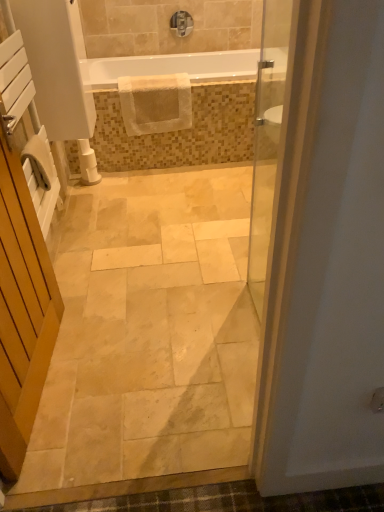
Question: From the image's perspective, is white glossy bathtub at upper center located beneath matte silver faucet at upper center?

Choices:
 (A) no
 (B) yes

Answer: (B)

Question: Is white glossy bathtub at upper center behind matte silver faucet at upper center?

Choices:
 (A) no
 (B) yes

Answer: (A)

Question: Considering the relative sizes of white glossy bathtub at upper center and matte silver faucet at upper center in the image provided, is white glossy bathtub at upper center bigger than matte silver faucet at upper center?

Choices:
 (A) yes
 (B) no

Answer: (A)

Question: From a real-world perspective, is white glossy bathtub at upper center on top of matte silver faucet at upper center?

Choices:
 (A) yes
 (B) no

Answer: (B)

Question: Can you confirm if white glossy bathtub at upper center is taller than matte silver faucet at upper center?

Choices:
 (A) yes
 (B) no

Answer: (B)

Question: Is white plastic toilet paper at lower left spatially inside white glossy bathtub at upper center, or outside of it?

Choices:
 (A) outside
 (B) inside

Answer: (A)

Question: Is white plastic toilet paper at lower left bigger or smaller than white glossy bathtub at upper center?

Choices:
 (A) big
 (B) small

Answer: (B)

Question: From the image's perspective, is white plastic toilet paper at lower left located above or below white glossy bathtub at upper center?

Choices:
 (A) below
 (B) above

Answer: (A)

Question: Is point (94, 168) closer or farther from the camera than point (258, 56)?

Choices:
 (A) farther
 (B) closer

Answer: (A)

Question: Which is correct: matte silver faucet at upper center is inside white textured mat at upper center, or outside of it?

Choices:
 (A) outside
 (B) inside

Answer: (A)

Question: Visually, is matte silver faucet at upper center positioned to the left or to the right of white textured mat at upper center?

Choices:
 (A) left
 (B) right

Answer: (B)

Question: From their relative heights in the image, would you say matte silver faucet at upper center is taller or shorter than white textured mat at upper center?

Choices:
 (A) short
 (B) tall

Answer: (A)

Question: From a real-world perspective, is matte silver faucet at upper center positioned above or below white textured mat at upper center?

Choices:
 (A) above
 (B) below

Answer: (A)

Question: Is white wooden screen door at left inside or outside of white glossy bathtub at upper center?

Choices:
 (A) outside
 (B) inside

Answer: (A)

Question: Is white wooden screen door at left taller or shorter than white glossy bathtub at upper center?

Choices:
 (A) short
 (B) tall

Answer: (B)